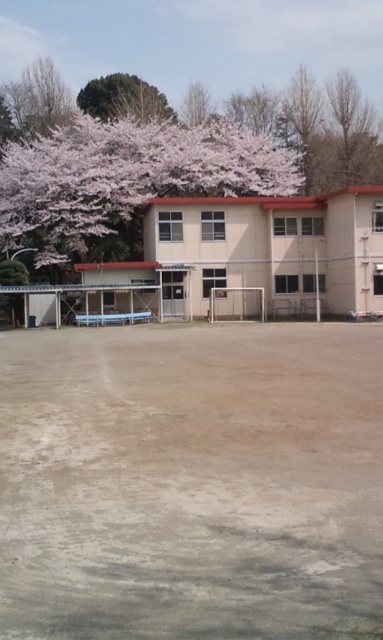
Question: Which object is the farthest from the brown sandy dirt field at center?

Choices:
 (A) pink blossoms at upper left
 (B) green leafy tree at upper center

Answer: (B)

Question: Can you confirm if brown sandy dirt field at center is wider than green leafy tree at upper center?

Choices:
 (A) no
 (B) yes

Answer: (A)

Question: Which of the following is the farthest from the observer?

Choices:
 (A) (119, 580)
 (B) (173, 173)

Answer: (B)

Question: Considering the real-world distances, which object is closest to the green leafy tree at upper center?

Choices:
 (A) brown sandy dirt field at center
 (B) pink blossoms at upper left

Answer: (B)

Question: Is pink blossoms at upper left to the right of green leafy tree at upper center from the viewer's perspective?

Choices:
 (A) no
 (B) yes

Answer: (B)

Question: Can you confirm if brown sandy dirt field at center is positioned above green leafy tree at upper center?

Choices:
 (A) no
 (B) yes

Answer: (A)